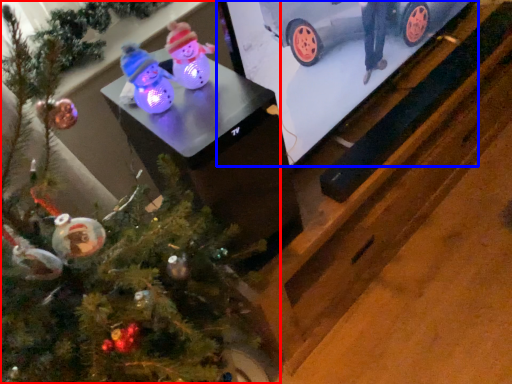
Question: Which point is further to the camera, christmas tree (highlighted by a red box) or tv show (highlighted by a blue box)?

Choices:
 (A) christmas tree
 (B) tv show

Answer: (B)